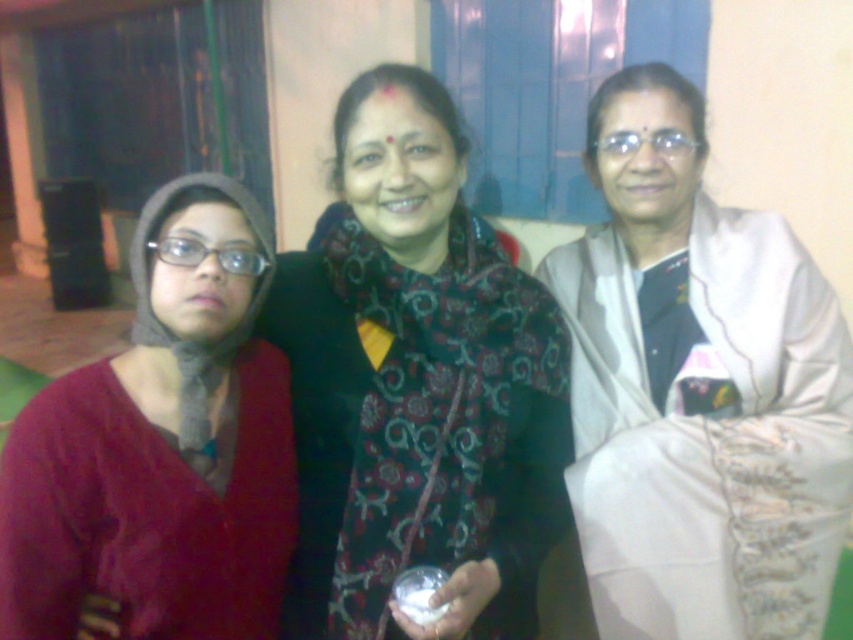
Describe the element at coordinates (698, 390) in the screenshot. Image resolution: width=853 pixels, height=640 pixels. I see `white satin saree at right` at that location.

Between point (712, 381) and point (33, 548), which one is positioned behind?

The point (712, 381) is behind.

You are a GUI agent. You are given a task and a screenshot of the screen. Output one action in this format:
    pyautogui.click(x=<x>, y=<y>)
    Task: Click on the white satin saree at right
    
    Given the screenshot: What is the action you would take?
    pyautogui.click(x=698, y=390)

Is white satin saree at right to the left of black floral scarf at center from the viewer's perspective?

No, white satin saree at right is not to the left of black floral scarf at center.

Where is `white satin saree at right`? white satin saree at right is located at coordinates (698, 390).

Is black floral scarf at center taller than knitted woolen scarf at left?

Correct, black floral scarf at center is much taller as knitted woolen scarf at left.

Who is more forward, (364, 76) or (212, 246)?

Point (212, 246)

Who is more distant from viewer, (x=346, y=440) or (x=140, y=611)?

Point (x=346, y=440)

Where is `black floral scarf at center`? black floral scarf at center is located at coordinates (416, 385).